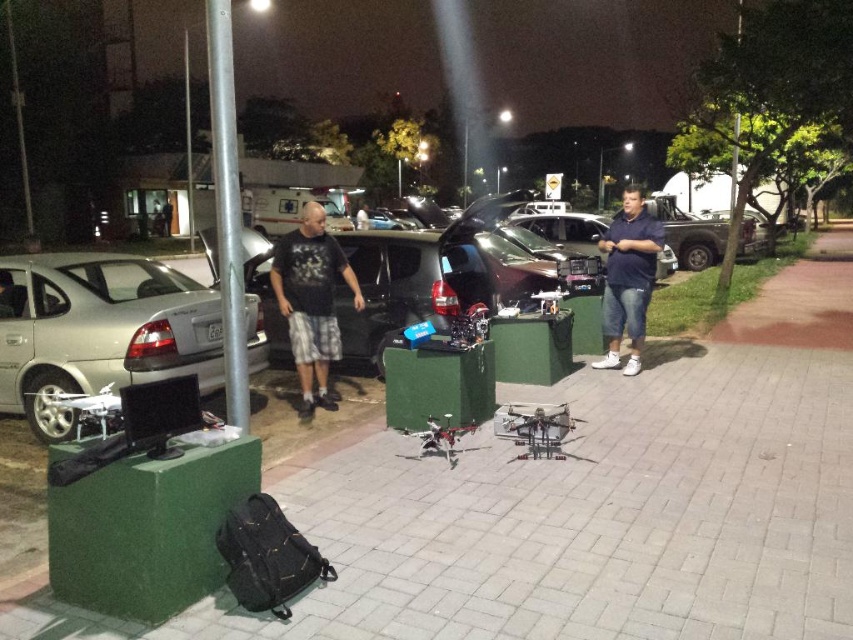
The height and width of the screenshot is (640, 853). Find the location of `silver metallic car at left`. silver metallic car at left is located at coordinates (97, 330).

Between point (126, 276) and point (646, 211), which one is positioned in front?

Positioned in front is point (126, 276).

Locate an element on the screen. The width and height of the screenshot is (853, 640). silver metallic car at left is located at coordinates (97, 330).

Which of these two, silver metallic pole at center-left or blue cotton shirt at center, stands shorter?

blue cotton shirt at center

Which is more to the left, silver metallic pole at center-left or blue cotton shirt at center?

silver metallic pole at center-left

Which is behind, point (213, 118) or point (612, 308)?

Point (612, 308)

This screenshot has height=640, width=853. What are the coordinates of `silver metallic pole at center-left` in the screenshot? It's located at (227, 209).

Who is taller, silver metallic car at left or black cotton t-shirt at center?

With more height is black cotton t-shirt at center.

Between point (84, 342) and point (306, 332), which one is positioned in front?

Point (84, 342) is in front.

Between point (99, 388) and point (318, 209), which one is positioned in front?

Point (99, 388) is more forward.

The image size is (853, 640). I want to click on silver metallic car at left, so click(97, 330).